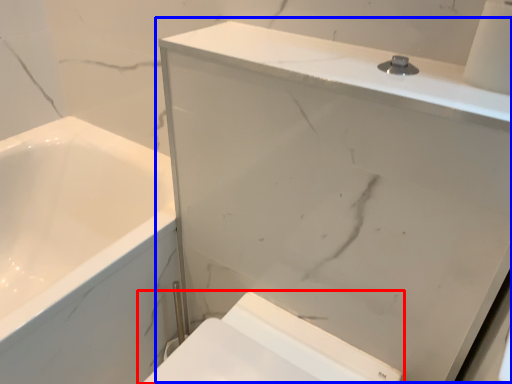
Question: Which point is further to the camera, toilet (highlighted by a red box) or medicine cabinet (highlighted by a blue box)?

Choices:
 (A) toilet
 (B) medicine cabinet

Answer: (A)